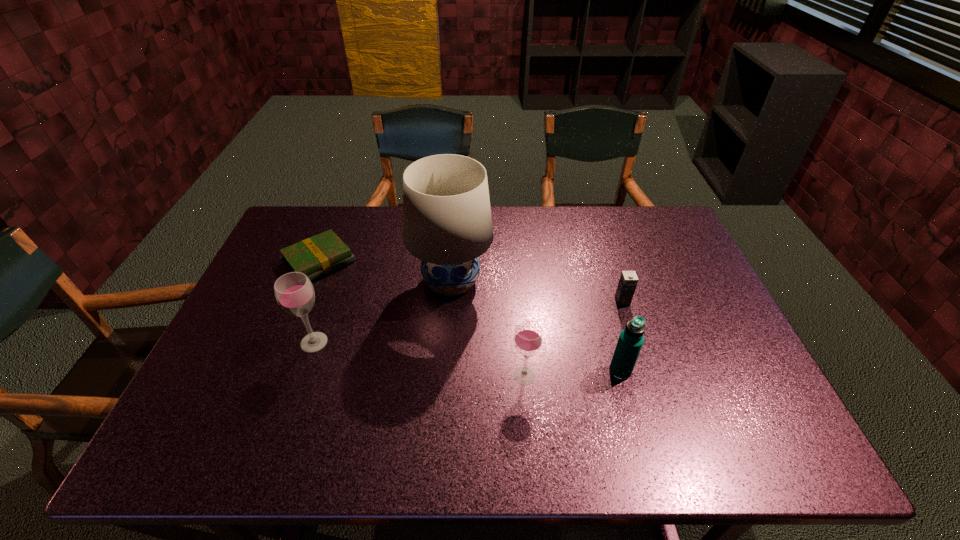
This screenshot has height=540, width=960. What are the coordinates of `the left wineglass` in the screenshot? It's located at (294, 292).

I want to click on the third nearest object, so click(294, 292).

This screenshot has width=960, height=540. What are the coordinates of `the nearer wineglass` in the screenshot? It's located at (528, 338).

I want to click on the third object from right to left, so click(x=528, y=338).

You are a GUI agent. You are given a task and a screenshot of the screen. Output one action in this format:
    pyautogui.click(x=<x>, y=<y>)
    Task: Click on the chocolate milk
    
    Given the screenshot: What is the action you would take?
    pyautogui.click(x=628, y=281)

Where is `the rightmost object`? This screenshot has height=540, width=960. the rightmost object is located at coordinates (628, 281).

Find the location of a particular element. the tallest object is located at coordinates (447, 223).

Locate an element on the screen. The image size is (960, 540). the fourth object from right to left is located at coordinates (447, 223).

This screenshot has width=960, height=540. Find the location of `the shortest object`. the shortest object is located at coordinates (316, 256).

This screenshot has width=960, height=540. Identify the location of water bottle. (631, 339).